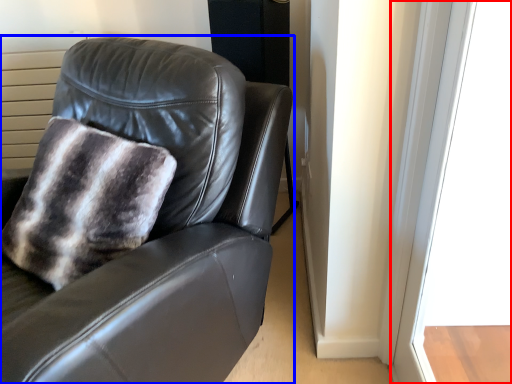
Question: Which of the following is the closest to the observer, window (highlighted by a red box) or chair (highlighted by a blue box)?

Choices:
 (A) window
 (B) chair

Answer: (A)